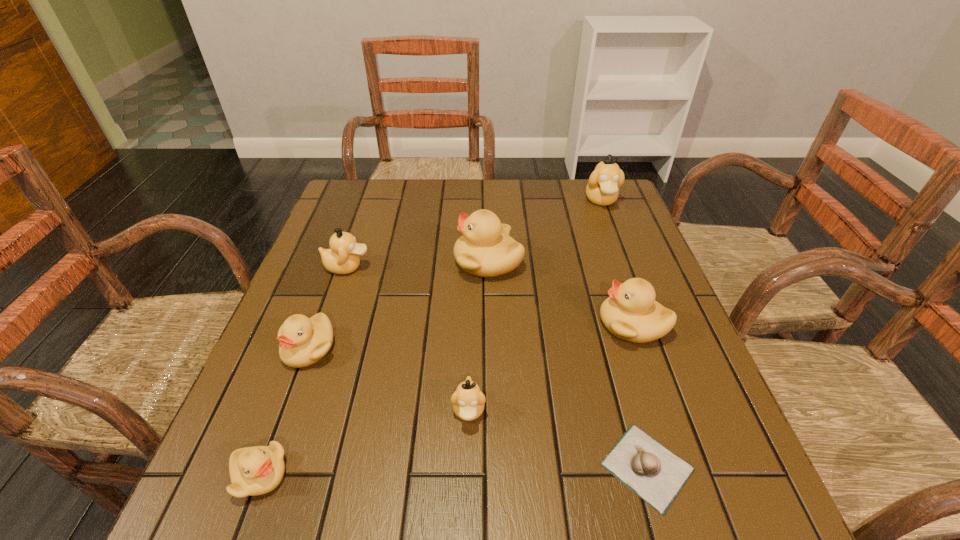
Where is `the fifth closest duckling to the farthest yellow duckling`? This screenshot has height=540, width=960. the fifth closest duckling to the farthest yellow duckling is located at coordinates (468, 401).

Locate which tan duckling ranks second in proximity to the rightmost tan duckling. Please provide its 2D coordinates. Your answer should be formatted as a tuple, i.e. [(x, y)], where the tuple contains the x and y coordinates of a point satisfying the conditions above.

[(468, 401)]

Locate which tan duckling ranks in proximity to the second shortest object. Please provide its 2D coordinates. Your answer should be formatted as a tuple, i.e. [(x, y)], where the tuple contains the x and y coordinates of a point satisfying the conditions above.

[(468, 401)]

Where is `yellow duckling that can be found as the fourth closest to the second biggest tan duckling`? This screenshot has width=960, height=540. yellow duckling that can be found as the fourth closest to the second biggest tan duckling is located at coordinates (631, 313).

The width and height of the screenshot is (960, 540). Identify the location of yellow duckling that is the second closest to the farthest duckling. (631, 313).

Where is `vacant area in the image that satisfies the following two spatial constraints: 1. on the face of the farthest tan duckling; 2. on the beak of the biggest yellow duckling`? The image size is (960, 540). vacant area in the image that satisfies the following two spatial constraints: 1. on the face of the farthest tan duckling; 2. on the beak of the biggest yellow duckling is located at coordinates coord(624,261).

Identify the location of free space in the image that satisfies the following two spatial constraints: 1. on the face of the biggest tan duckling; 2. on the beak of the nearest duckling. (705, 475).

Image resolution: width=960 pixels, height=540 pixels. I want to click on vacant point that satisfies the following two spatial constraints: 1. on the face of the second nearest duckling; 2. on the beak of the second shortest object, so click(468, 475).

I want to click on vacant space that satisfies the following two spatial constraints: 1. on the front side of the shortest object; 2. on the beak of the nearest yellow duckling, so pyautogui.click(x=649, y=475).

The width and height of the screenshot is (960, 540). Find the location of `vacant region that satisfies the following two spatial constraints: 1. on the face of the second biggest tan duckling; 2. on the left side of the shortest object`. vacant region that satisfies the following two spatial constraints: 1. on the face of the second biggest tan duckling; 2. on the left side of the shortest object is located at coordinates (279, 467).